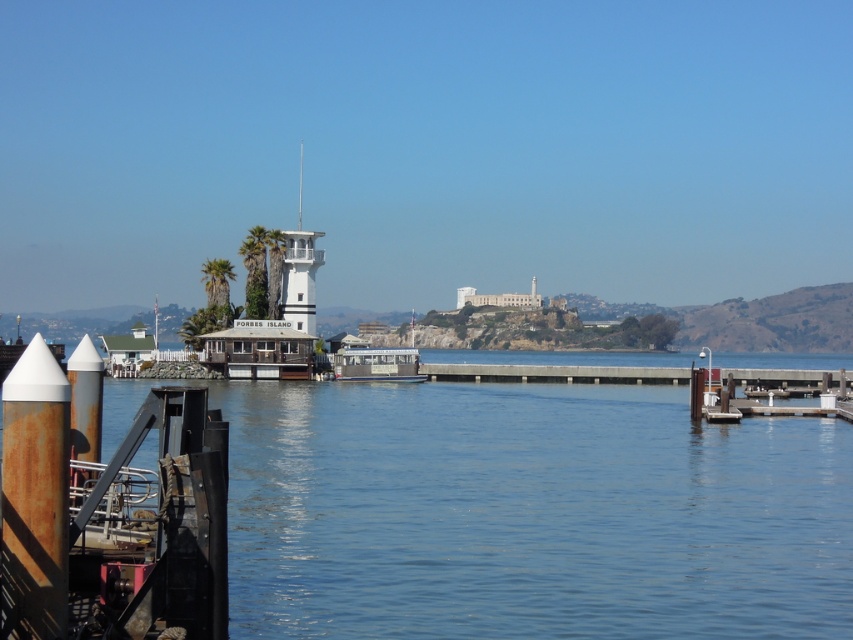
Question: Can you confirm if white painted wood tower at center is positioned below green leafy palm tree at center-left?

Choices:
 (A) yes
 (B) no

Answer: (B)

Question: Can you confirm if green leafy palm tree at center is thinner than green leafy palm tree at center-left?

Choices:
 (A) yes
 (B) no

Answer: (A)

Question: Which is nearer to the white wooden dock at center?

Choices:
 (A) green leafy palm tree at center
 (B) green leafy palm tree at center-left
 (C) white painted wood tower at center

Answer: (A)

Question: Can you confirm if white painted wood tower at center is positioned to the left of green leafy palm tree at center?

Choices:
 (A) yes
 (B) no

Answer: (A)

Question: Estimate the real-world distances between objects in this image. Which object is closer to the white painted wood tower at center?

Choices:
 (A) green leafy palm tree at center-left
 (B) white wooden dock at center
 (C) green leafy palm tree at center

Answer: (A)

Question: Which point is farther to the camera?

Choices:
 (A) (210, 289)
 (B) (354, 378)
 (C) (242, 260)
 (D) (296, 316)

Answer: (C)